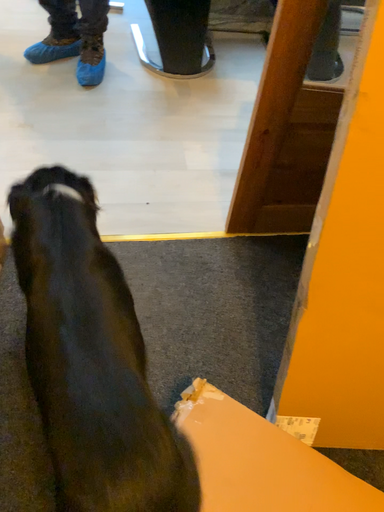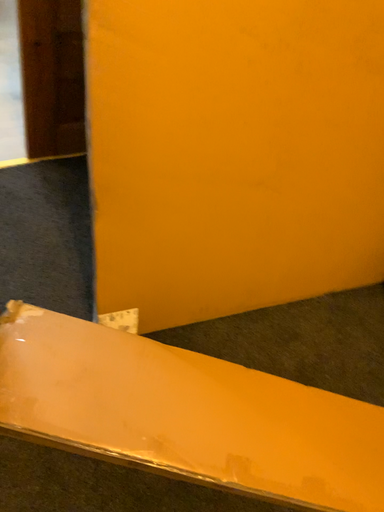
Question: How did the camera likely rotate when shooting the video?

Choices:
 (A) rotated right
 (B) rotated left

Answer: (A)